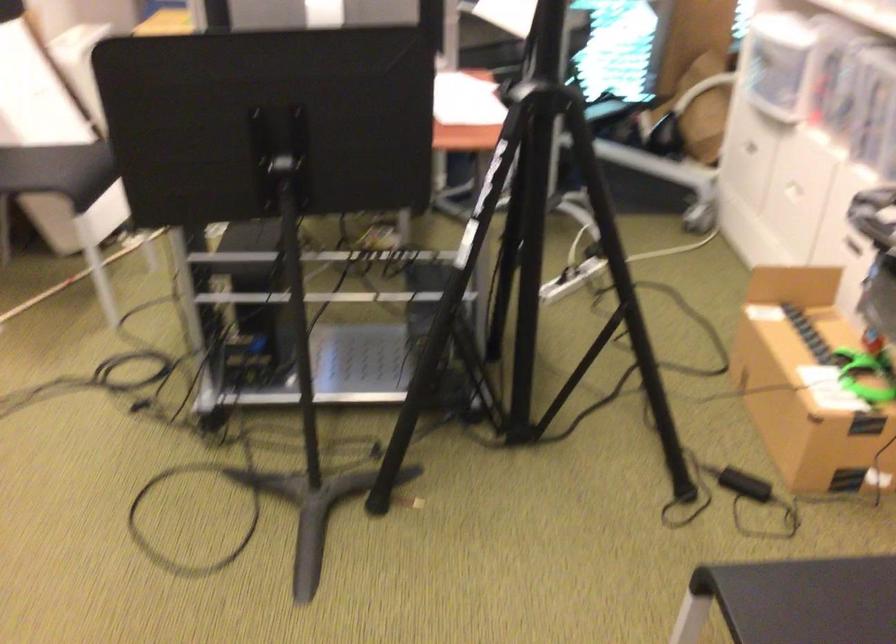
Find where to sit the chair sitting surface. Please return your answer as a coordinate pair (x, y).

(45, 166)